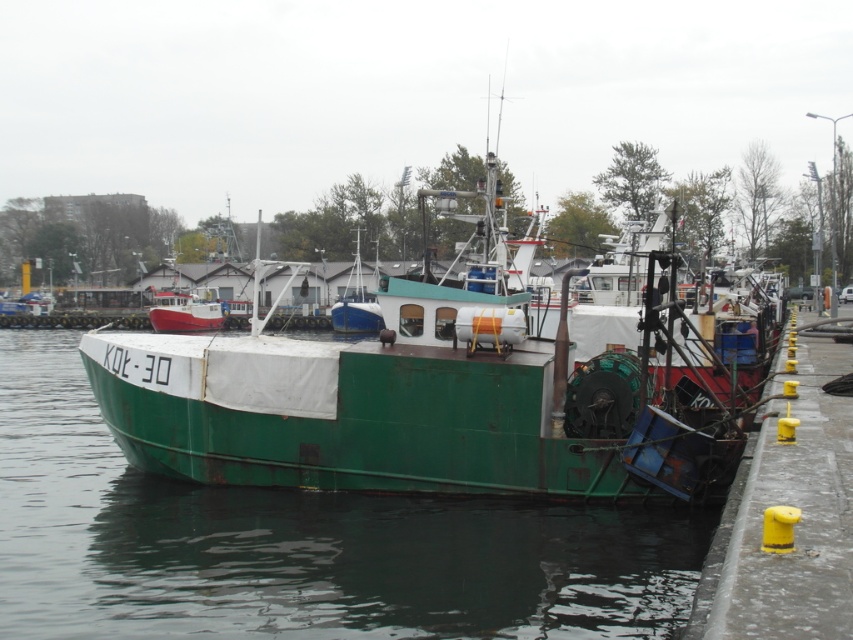
In the scene shown: Who is more distant from viewer, (160, 628) or (796, 564)?

The point (160, 628) is more distant.

From the picture: Does green matte water at center lie in front of yellow rubber bollard at lower right?

No, it is behind yellow rubber bollard at lower right.

Between point (440, 616) and point (798, 403), which one is positioned in front?

Positioned in front is point (440, 616).

This screenshot has height=640, width=853. I want to click on green matte water at center, so click(299, 544).

From the picture: Who is more forward, (x=660, y=298) or (x=810, y=417)?

Point (x=810, y=417)

Where is `green matte boat at center`? This screenshot has width=853, height=640. green matte boat at center is located at coordinates (448, 387).

I want to click on green matte boat at center, so click(448, 387).

In the scene shown: Does green matte boat at center have a lesser width compared to green matte water at center?

In fact, green matte boat at center might be wider than green matte water at center.

Which is more to the left, green matte boat at center or green matte water at center?

From the viewer's perspective, green matte water at center appears more on the left side.

Is point (675, 401) behind point (535, 548)?

Yes, it is behind point (535, 548).

Where is `green matte boat at center`? The width and height of the screenshot is (853, 640). green matte boat at center is located at coordinates (448, 387).